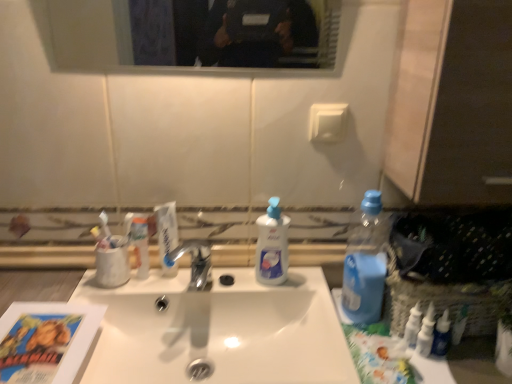
This screenshot has height=384, width=512. Identify the location of vacant space that is to the left of translucent plastic tube at center, which is counted as the 3th toiletry, starting from the right. (69, 289).